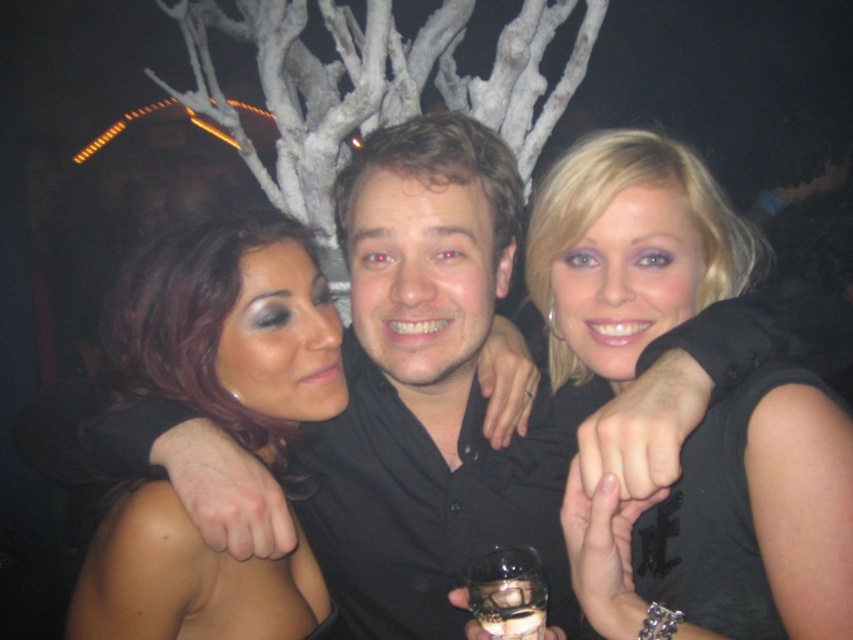
Which of these two, black matte dress at center or shiny dark hair at center, stands taller?

Standing taller between the two is black matte dress at center.

Does black matte dress at center appear under shiny dark hair at center?

No.

Identify the location of black matte dress at center. This screenshot has width=853, height=640. (735, 525).